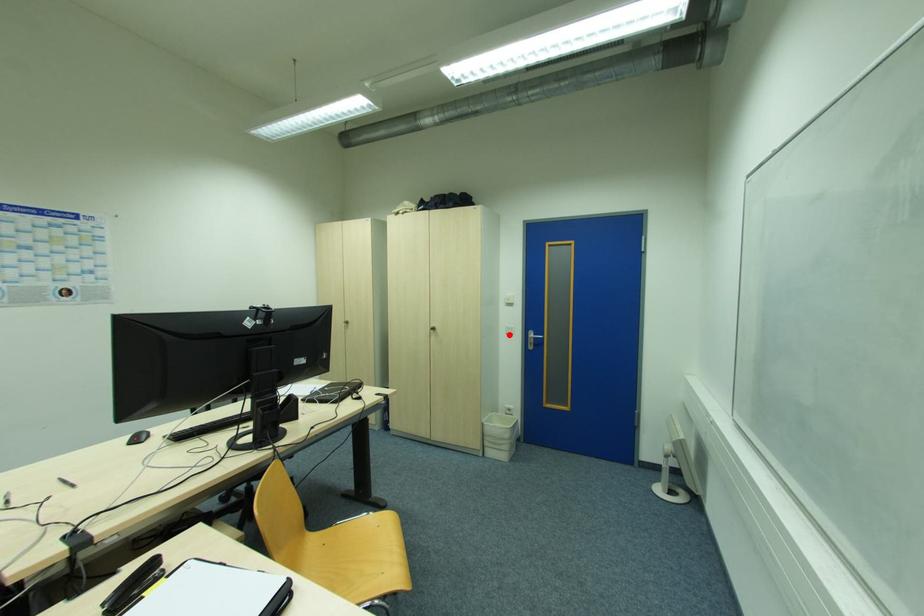
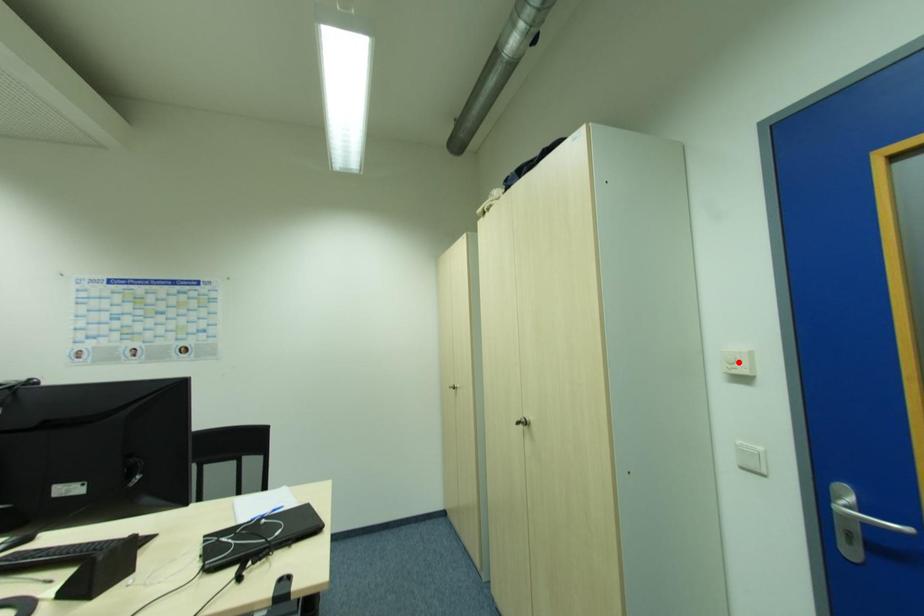
I am providing you with two images of the same scene from different viewpoints. A red point is marked on the first image and another point is marked on the second image. Do the highlighted points in image1 and image2 indicate the same real-world spot?

No